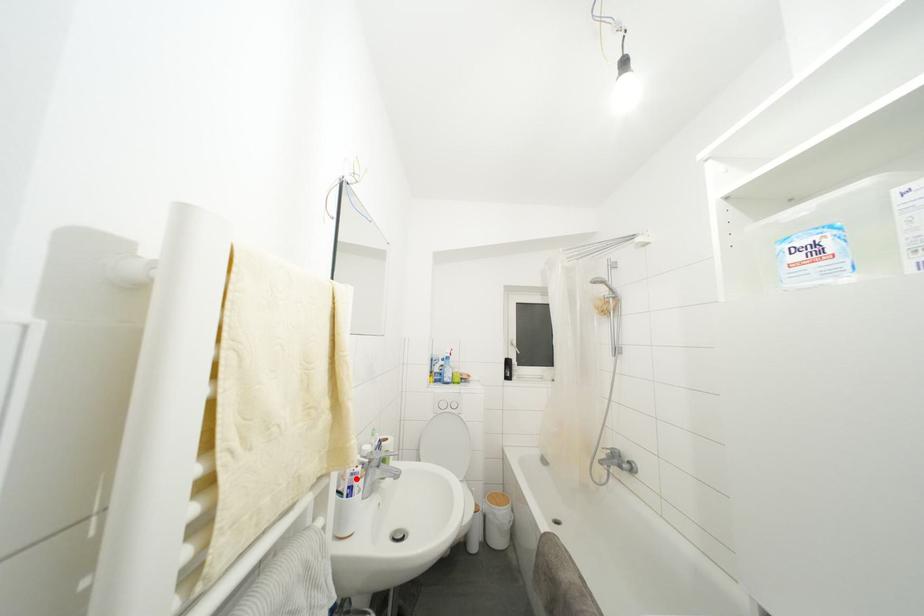
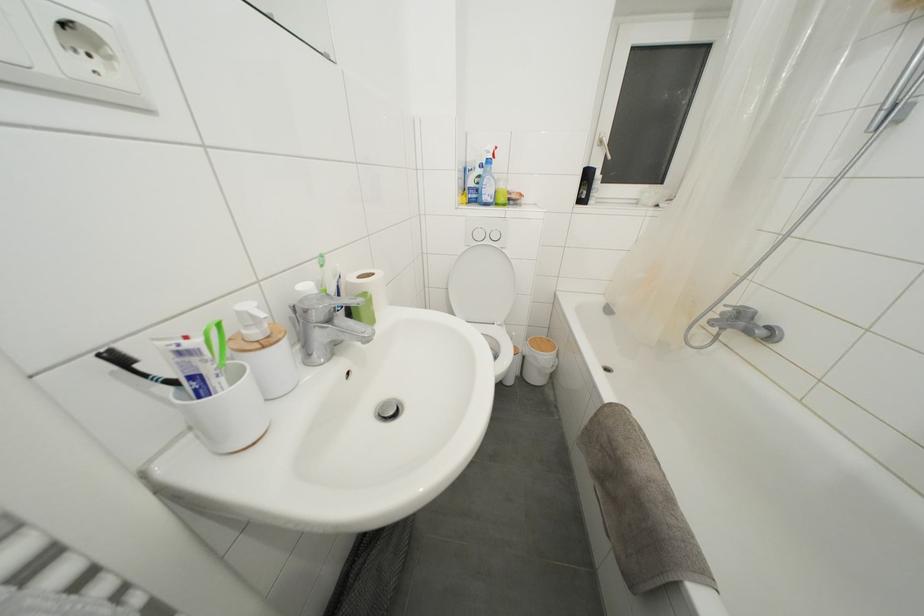
Find the pixel in the second image that matches the highlighted location in the first image.

(185, 358)